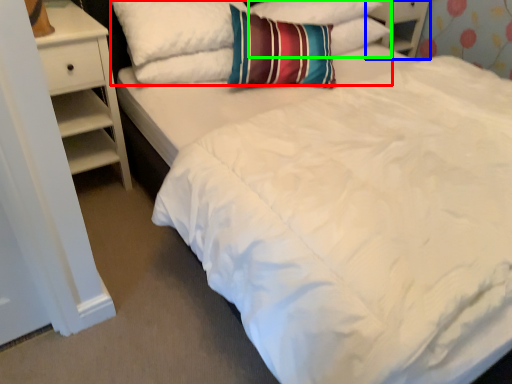
Question: Based on their relative distances, which object is nearer to pillow (highlighted by a red box)? Choose from dresser (highlighted by a blue box) and pillow (highlighted by a green box).

Choices:
 (A) dresser
 (B) pillow

Answer: (B)